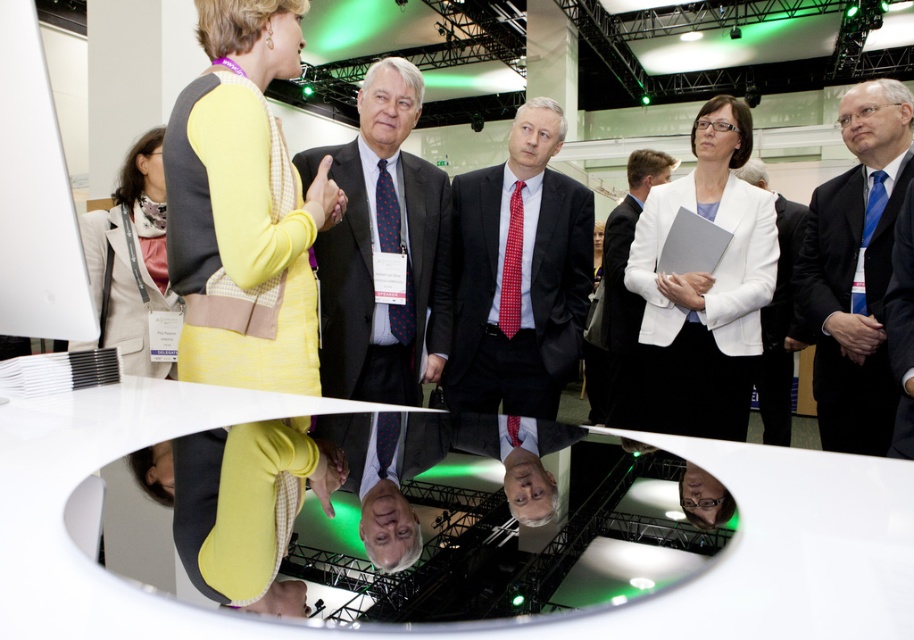
You are organizing a photo shoot and need to arrange two models wearing the dark suit at center and white fabric suit at center. Based on their height difference, which model should stand in front to ensure both are visible in the photo?

The dark suit at center is shorter than the white fabric suit at center, so the model in the dark suit at center should stand in front to ensure both are visible in the photo.

You are standing at the entrance of the event and want to approach both the dark suit at center and the white fabric suit at center. Given that you can only move forward in a straight line, will you be able to reach both without deviating from your path?

The dark suit at center and white fabric suit at center are 5.12 feet apart. Since they are positioned at the same central area and spaced apart, you can move straight towards the center and reach both without needing to deviate from your path as long as your straight path aligns with their central positioning.